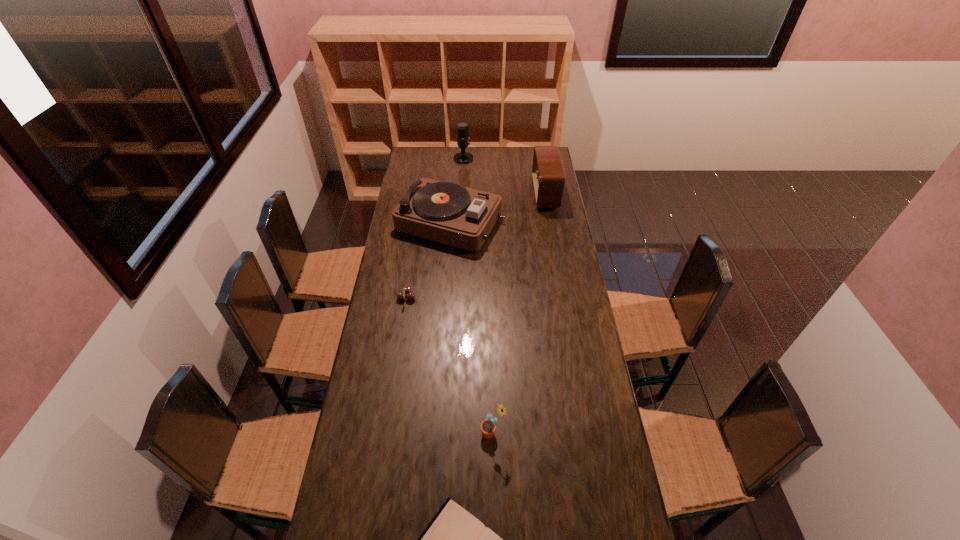
Identify the location of free space located on the flower of the second nearest object. (372, 433).

Where is `free location located 0.050m on the flower of the second nearest object`? free location located 0.050m on the flower of the second nearest object is located at coordinates (464, 433).

I want to click on vacant region located on the flower of the second nearest object, so click(359, 433).

The width and height of the screenshot is (960, 540). Find the location of `vacant space situated 0.300m on the back of the record player`. vacant space situated 0.300m on the back of the record player is located at coordinates (455, 163).

The image size is (960, 540). Identify the location of vacant region located 0.350m on the leaves of the fourth farthest object. (503, 298).

This screenshot has width=960, height=540. What are the coordinates of `object at the far edge` in the screenshot? It's located at tap(463, 139).

Identify the location of record player that is at the left edge. (446, 212).

Find the location of a particular element. The image size is (960, 540). cherry located in the left edge section of the desktop is located at coordinates (410, 296).

At what (x,y) coordinates should I click in order to perform the action: click on object that is at the right edge. Please return your answer as a coordinate pair (x, y). The height and width of the screenshot is (540, 960). Looking at the image, I should click on (548, 176).

In the image, there is a desktop. Identify the location of vacant region at the far edge. point(509,153).